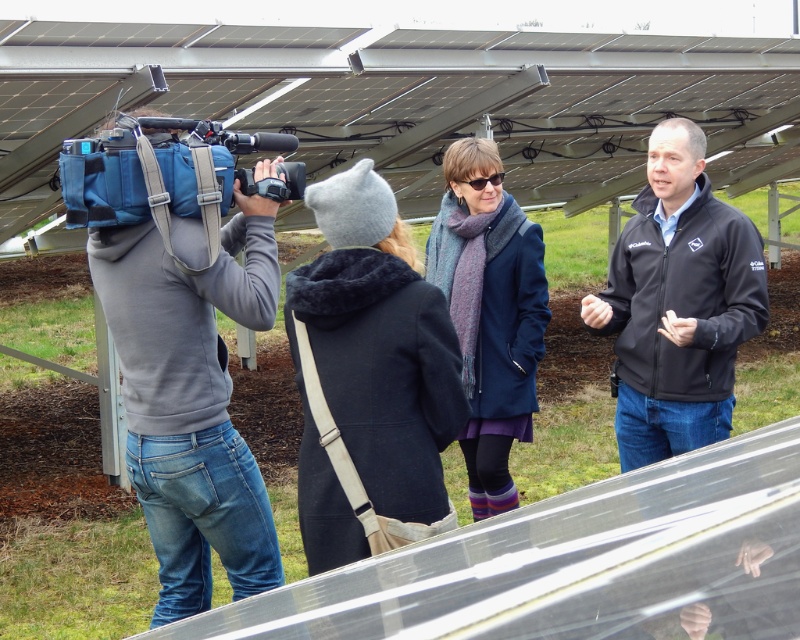
Question: Which point appears farthest from the camera in this image?

Choices:
 (A) (344, 509)
 (B) (288, 168)
 (C) (514, 406)

Answer: (C)

Question: Estimate the real-world distances between objects in this image. Which object is farther from the black plastic sunglasses at center?

Choices:
 (A) dark blue wool coat at center
 (B) black matte camera at center
 (C) knitted scarf at center

Answer: (A)

Question: Considering the relative positions of black matte camera at center and black plastic sunglasses at center in the image provided, where is black matte camera at center located with respect to black plastic sunglasses at center?

Choices:
 (A) below
 (B) above

Answer: (A)

Question: Does dark blue wool coat at center come in front of knitted scarf at center?

Choices:
 (A) no
 (B) yes

Answer: (B)

Question: Does knitted scarf at center have a lesser width compared to black plastic sunglasses at center?

Choices:
 (A) yes
 (B) no

Answer: (B)

Question: Which object is the closest to the black plastic sunglasses at center?

Choices:
 (A) black matte camera at center
 (B) dark blue wool coat at center
 (C) knitted scarf at center

Answer: (C)